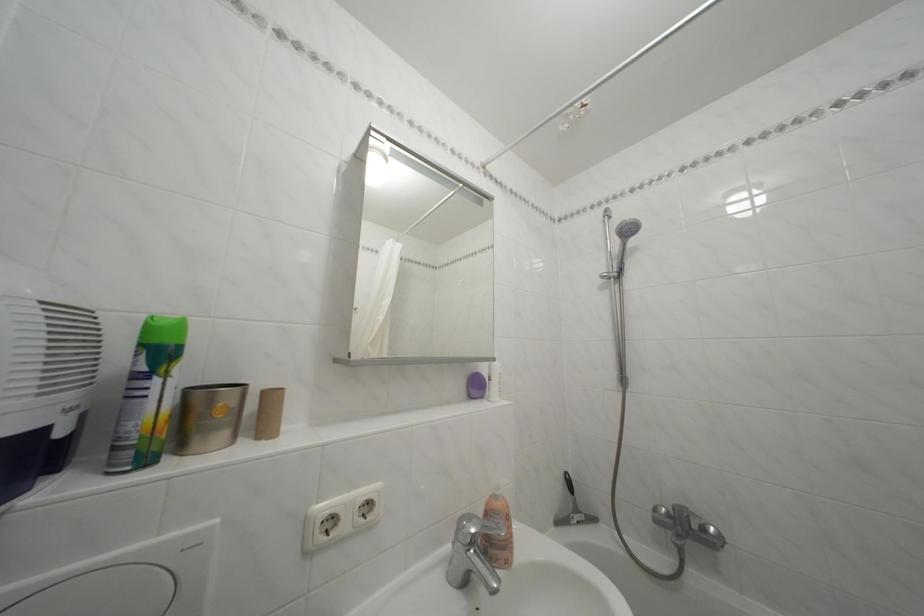
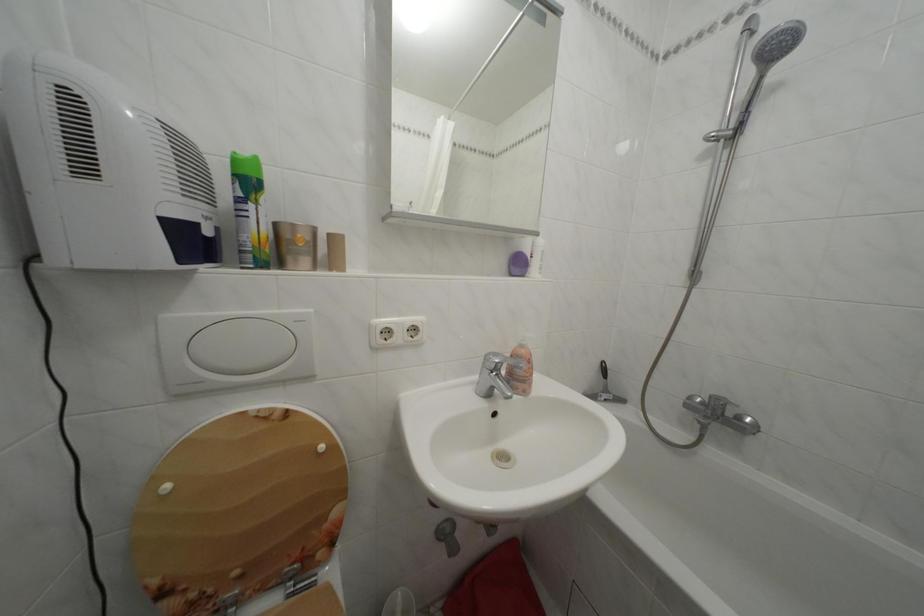
Question: The first image is from the beginning of the video and the second image is from the end. How did the camera likely rotate when shooting the video?

Choices:
 (A) Left
 (B) Right
 (C) Up
 (D) Down

Answer: (D)